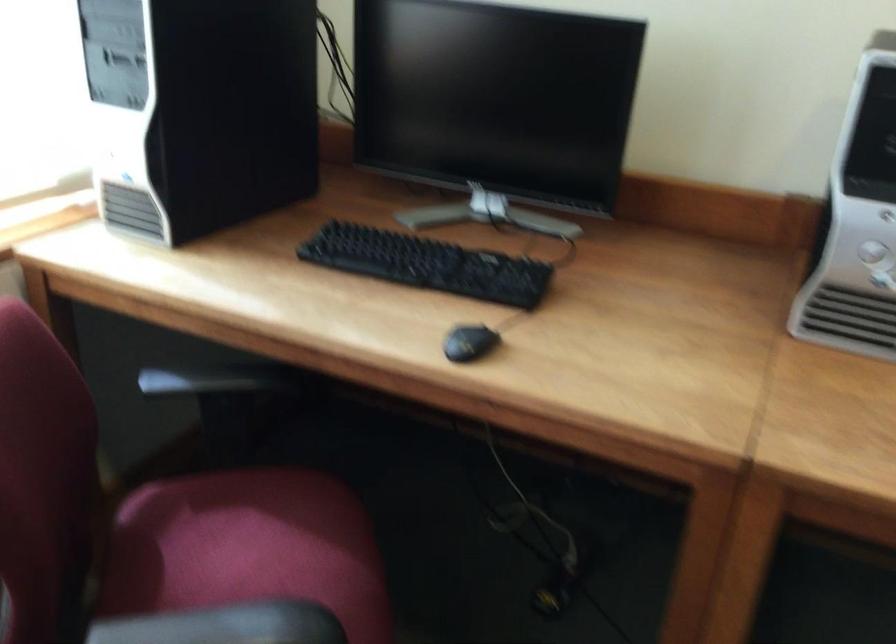
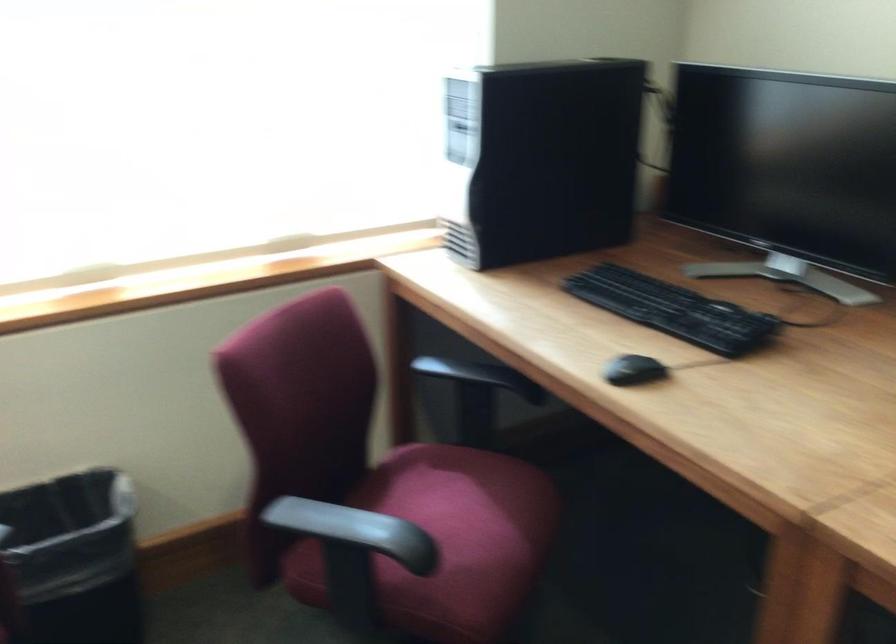
Question: The camera is either moving clockwise (left) or counter-clockwise (right) around the object. The first image is from the beginning of the video and the second image is from the end. Is the camera moving left or right when shooting the video?

Choices:
 (A) Left
 (B) Right

Answer: (B)